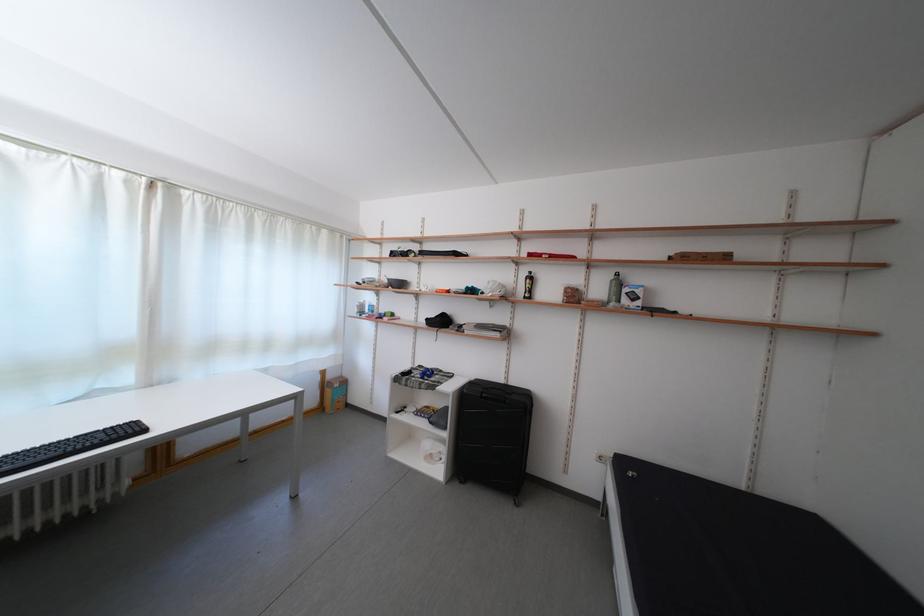
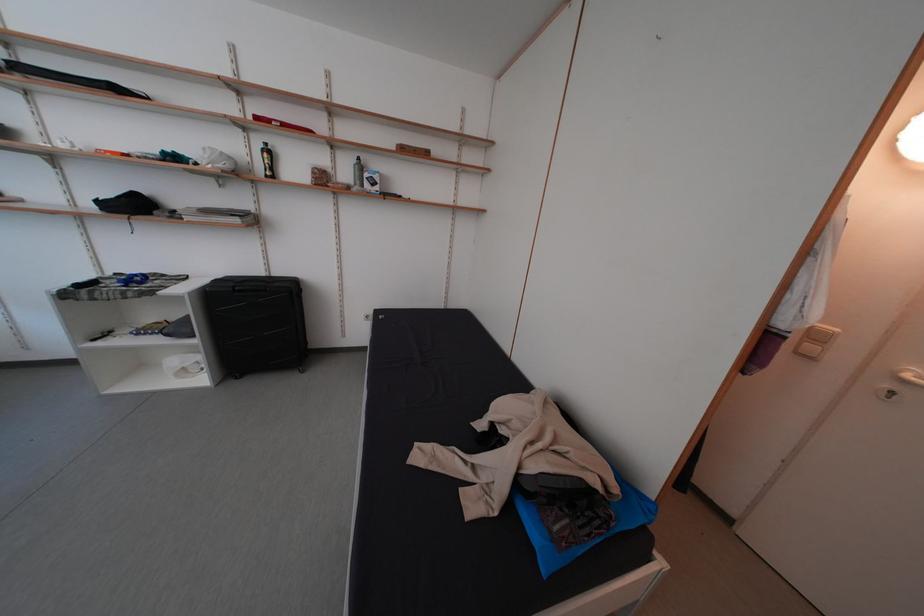
The point at (608, 296) is marked in the first image. Where is the corresponding point in the second image?

(354, 179)